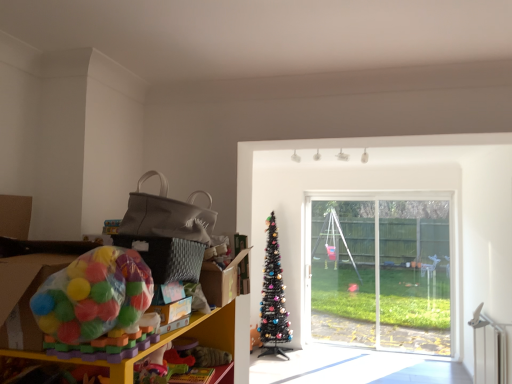
Question: Does transparent glass window at center have a lesser height compared to translucent plastic ball pit at left?

Choices:
 (A) yes
 (B) no

Answer: (B)

Question: Can you confirm if transparent glass window at center is wider than translucent plastic ball pit at left?

Choices:
 (A) yes
 (B) no

Answer: (B)

Question: Is transparent glass window at center positioned before translucent plastic ball pit at left?

Choices:
 (A) yes
 (B) no

Answer: (B)

Question: Considering the relative positions of transparent glass window at center and translucent plastic ball pit at left in the image provided, is transparent glass window at center to the left of translucent plastic ball pit at left from the viewer's perspective?

Choices:
 (A) yes
 (B) no

Answer: (B)

Question: From a real-world perspective, is transparent glass window at center beneath translucent plastic ball pit at left?

Choices:
 (A) no
 (B) yes

Answer: (B)

Question: From the image's perspective, would you say transparent glass window at center is shown under translucent plastic ball pit at left?

Choices:
 (A) yes
 (B) no

Answer: (A)

Question: Considering the relative positions of transparent glass window at center and black artificial christmas tree at center in the image provided, is transparent glass window at center to the right of black artificial christmas tree at center from the viewer's perspective?

Choices:
 (A) no
 (B) yes

Answer: (B)

Question: Can you confirm if transparent glass window at center is bigger than black artificial christmas tree at center?

Choices:
 (A) no
 (B) yes

Answer: (B)

Question: Does transparent glass window at center have a greater height compared to black artificial christmas tree at center?

Choices:
 (A) no
 (B) yes

Answer: (B)

Question: From a real-world perspective, is transparent glass window at center under black artificial christmas tree at center?

Choices:
 (A) no
 (B) yes

Answer: (A)

Question: Is transparent glass window at center wider than black artificial christmas tree at center?

Choices:
 (A) yes
 (B) no

Answer: (B)

Question: Is there a large distance between transparent glass window at center and black artificial christmas tree at center?

Choices:
 (A) no
 (B) yes

Answer: (B)

Question: Is black artificial christmas tree at center thinner than transparent glass window at center?

Choices:
 (A) yes
 (B) no

Answer: (B)